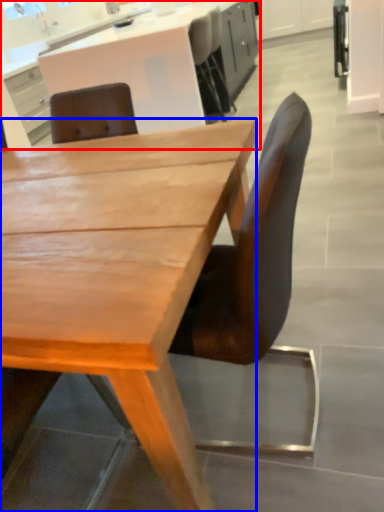
Question: Among these objects, which one is nearest to the camera, cabinetry (highlighted by a red box) or desk (highlighted by a blue box)?

Choices:
 (A) cabinetry
 (B) desk

Answer: (B)